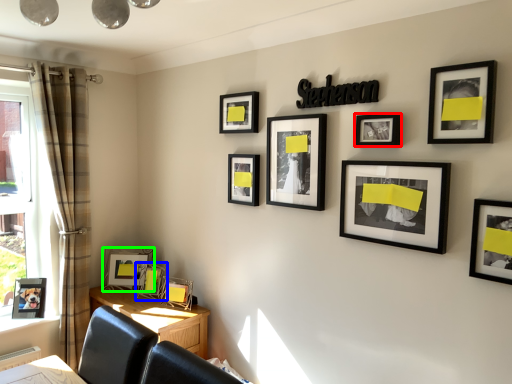
Question: Estimate the real-world distances between objects in this image. Which object is farther from picture frame (highlighted by a red box), picture frame (highlighted by a blue box) or picture frame (highlighted by a green box)?

Choices:
 (A) picture frame
 (B) picture frame

Answer: (B)